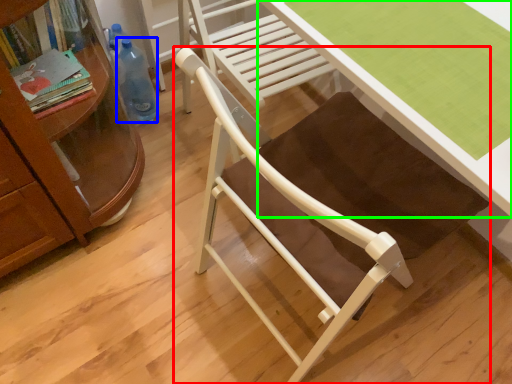
Question: Which object is the farthest from chair (highlighted by a red box)? Choose among these: bottle (highlighted by a blue box) or desk (highlighted by a green box).

Choices:
 (A) bottle
 (B) desk

Answer: (A)